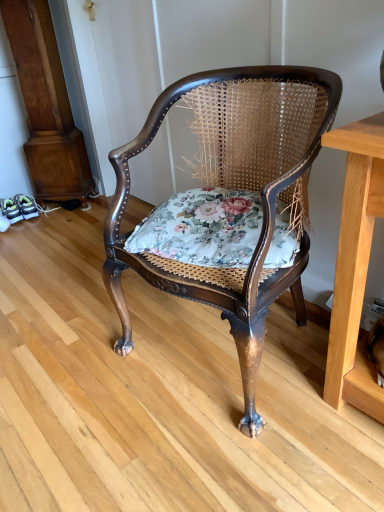
Question: Is floral fabric cushion at center aimed at polished wood chair at center?

Choices:
 (A) yes
 (B) no

Answer: (A)

Question: From a real-world perspective, is floral fabric cushion at center positioned over polished wood chair at center based on gravity?

Choices:
 (A) yes
 (B) no

Answer: (A)

Question: Is floral fabric cushion at center positioned before polished wood chair at center?

Choices:
 (A) yes
 (B) no

Answer: (B)

Question: Does floral fabric cushion at center appear on the right side of polished wood chair at center?

Choices:
 (A) yes
 (B) no

Answer: (B)

Question: From a real-world perspective, is floral fabric cushion at center located beneath polished wood chair at center?

Choices:
 (A) yes
 (B) no

Answer: (B)

Question: Is floral fabric cushion at center positioned beyond the bounds of polished wood chair at center?

Choices:
 (A) no
 (B) yes

Answer: (A)

Question: Is polished wood chair at center to the left of floral fabric cushion at center from the viewer's perspective?

Choices:
 (A) yes
 (B) no

Answer: (B)

Question: Can you confirm if polished wood chair at center is bigger than floral fabric cushion at center?

Choices:
 (A) no
 (B) yes

Answer: (B)

Question: Does polished wood chair at center lie in front of floral fabric cushion at center?

Choices:
 (A) yes
 (B) no

Answer: (A)

Question: Does polished wood chair at center have a lesser width compared to floral fabric cushion at center?

Choices:
 (A) yes
 (B) no

Answer: (B)

Question: From the image's perspective, is polished wood chair at center above floral fabric cushion at center?

Choices:
 (A) no
 (B) yes

Answer: (A)

Question: Does polished wood chair at center have a smaller size compared to floral fabric cushion at center?

Choices:
 (A) yes
 (B) no

Answer: (B)

Question: Is floral fabric cushion at center bigger or smaller than polished wood chair at center?

Choices:
 (A) small
 (B) big

Answer: (A)